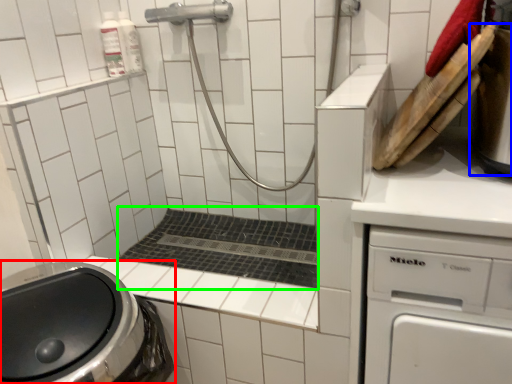
Question: Based on their relative distances, which object is nearer to washing machine (highlighted by a red box)? Choose from appliance (highlighted by a blue box) and bath (highlighted by a green box).

Choices:
 (A) appliance
 (B) bath

Answer: (B)